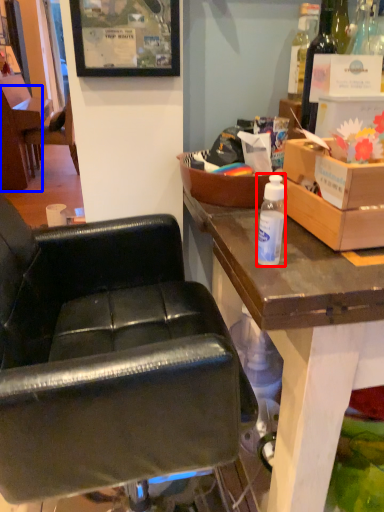
Question: Which point is further to the camera, bottle (highlighted by a red box) or chair (highlighted by a blue box)?

Choices:
 (A) bottle
 (B) chair

Answer: (B)